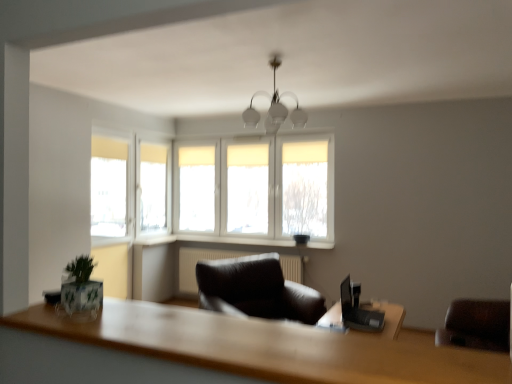
You are a GUI agent. You are given a task and a screenshot of the screen. Output one action in this format:
    pyautogui.click(x=<x>, y=<y>)
    Task: Click on the free space above wooden table at lower center (from a real-world perspective)
    
    Given the screenshot: What is the action you would take?
    pyautogui.click(x=234, y=331)